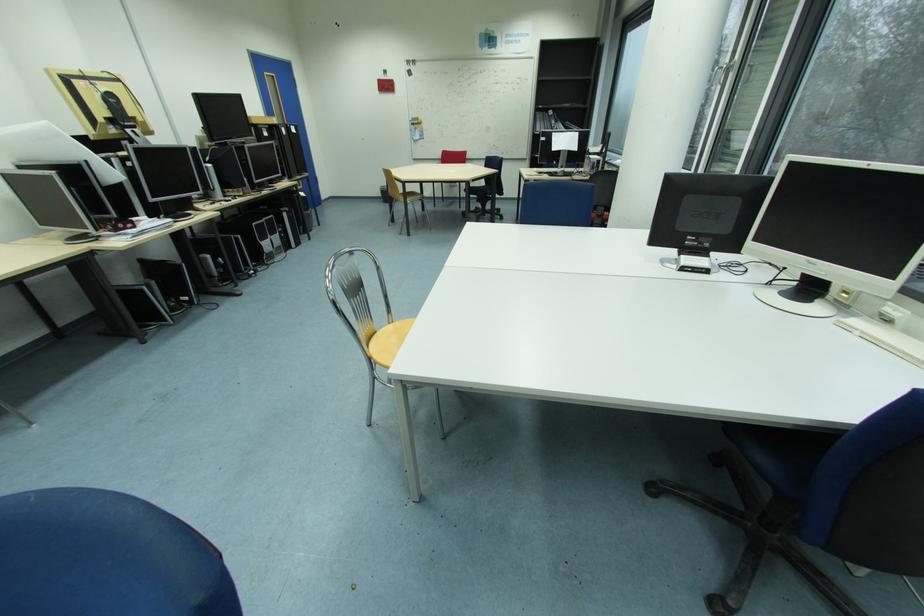
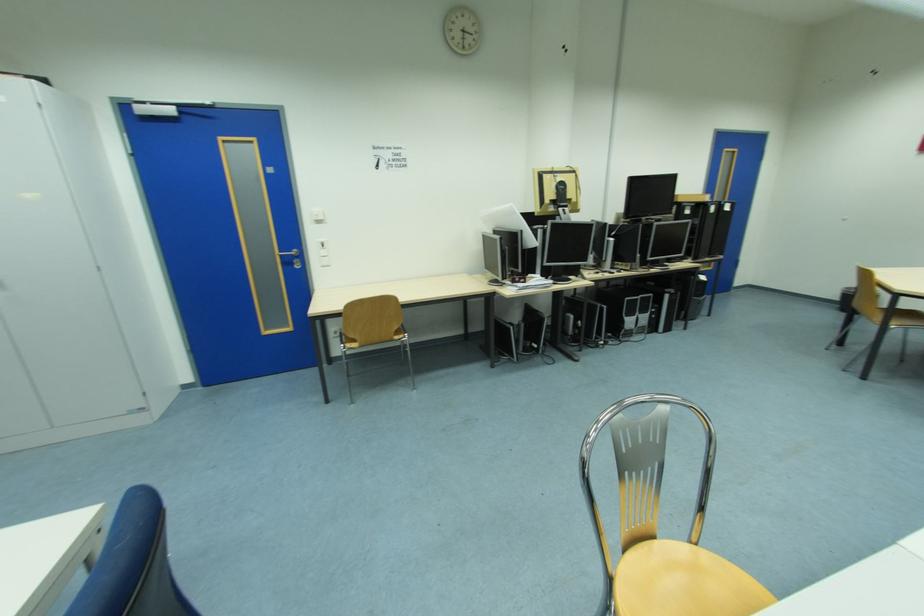
Question: The camera is either moving clockwise (left) or counter-clockwise (right) around the object. The first image is from the beginning of the video and the second image is from the end. Is the camera moving left or right when shooting the video?

Choices:
 (A) Left
 (B) Right

Answer: (B)